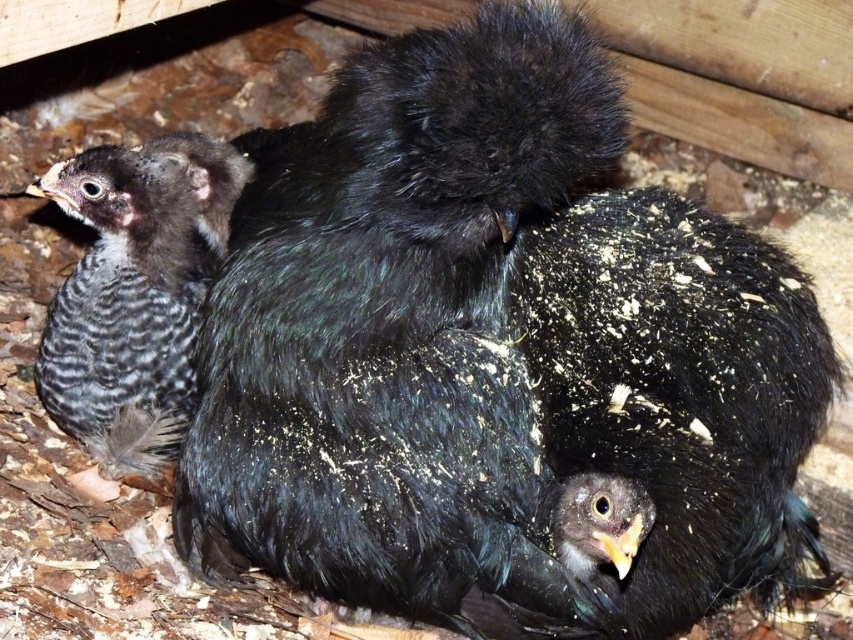
How much distance is there between black fluffy bird at center and speckled feathered chick at left?

29.06 centimeters

Which of these two, black fluffy bird at center or speckled feathered chick at left, stands shorter?

Standing shorter between the two is speckled feathered chick at left.

Does point (229, 324) lie behind point (102, 342)?

No, it is not.

Locate an element on the screen. This screenshot has width=853, height=640. black fluffy bird at center is located at coordinates (407, 340).